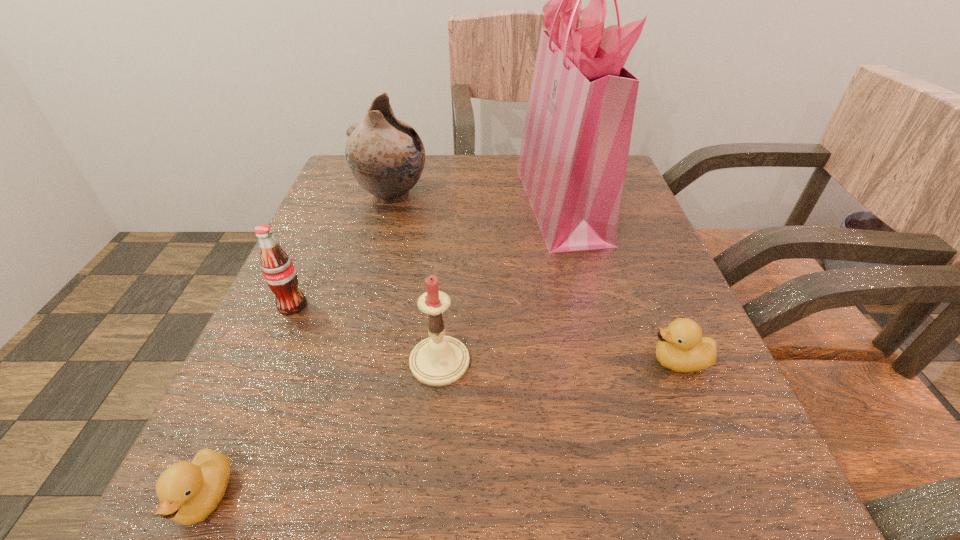
Locate an element on the screen. The image size is (960, 540). unoccupied position between the candle and the fourth object from right to left is located at coordinates (416, 279).

Where is `unoccupied area between the candle and the nearest object`? This screenshot has height=540, width=960. unoccupied area between the candle and the nearest object is located at coordinates (323, 429).

This screenshot has height=540, width=960. I want to click on object that is the second closest to the tallest object, so click(681, 347).

At what (x,y) coordinates should I click in order to perform the action: click on the fifth closest object relative to the farther duckling. Please return your answer as a coordinate pair (x, y). The image size is (960, 540). Looking at the image, I should click on (188, 492).

Find the location of a particular element. free space that satisfies the following two spatial constraints: 1. from the spout of the pottery; 2. facing forward on the nearest object is located at coordinates (308, 497).

Find the location of a particular element. The height and width of the screenshot is (540, 960). free space that satisfies the following two spatial constraints: 1. from the spout of the third object from left to right; 2. facing forward on the nearest object is located at coordinates (308, 497).

The width and height of the screenshot is (960, 540). What are the coordinates of `blank space that satisfies the following two spatial constraints: 1. on the face of the right duckling; 2. facing forward on the left duckling` in the screenshot? It's located at (734, 497).

This screenshot has height=540, width=960. Find the location of `vacant point that satisfies the following two spatial constraints: 1. from the spout of the third object from left to right; 2. facing forward on the left duckling`. vacant point that satisfies the following two spatial constraints: 1. from the spout of the third object from left to right; 2. facing forward on the left duckling is located at coordinates (308, 497).